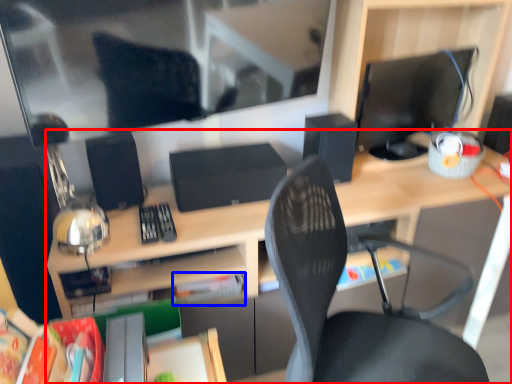
Question: Which point is closer to the camera, desk (highlighted by a red box) or paperback book (highlighted by a blue box)?

Choices:
 (A) desk
 (B) paperback book

Answer: (A)